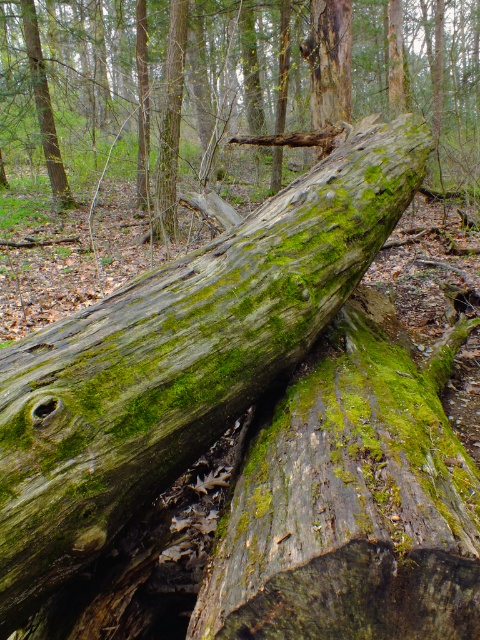
You are a hiker trying to cross a forest path. You see the green mossy wood log at center and the green mossy wood at center. Which one is higher up?

The green mossy wood log at center is located above the green mossy wood at center, so it is higher up.

You are a hiker who wants to cross the fallen tree trunk. You see the green mossy wood at center and the green mossy log at center. Which one is on the right side when facing the tree trunk?

The green mossy wood at center is positioned on the right side of green mossy log at center, so when facing the tree trunk, the green mossy wood at center is on the right side.

You are a hiker who needs to cross over the green mossy wood at center and the green mossy log at center. Which one is easier to step over based on their sizes?

The green mossy wood at center has a smaller size compared to the green mossy log at center, so it is easier to step over the green mossy wood at center.